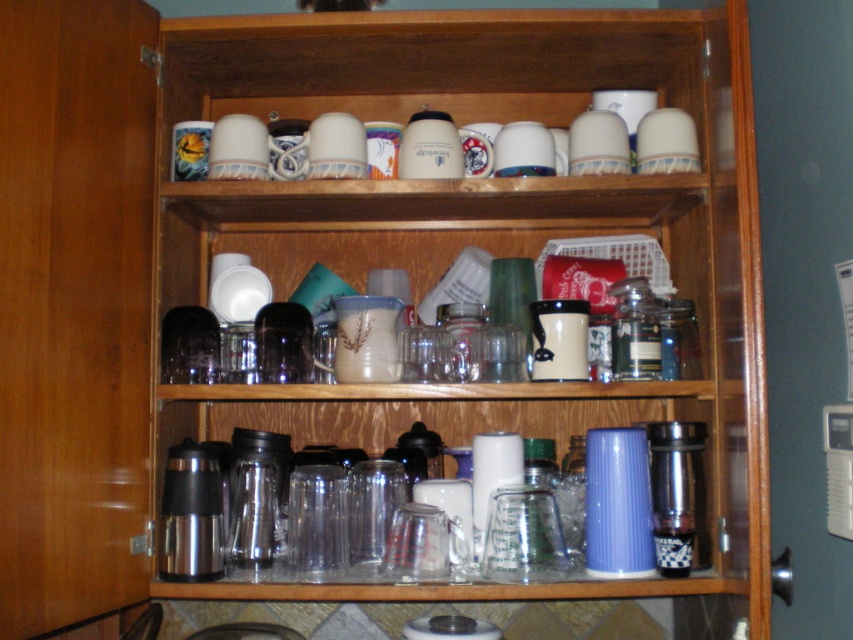
Does translucent glass cups at upper center have a greater height compared to metallic thermos at lower center?

Correct, translucent glass cups at upper center is much taller as metallic thermos at lower center.

Can you confirm if translucent glass cups at upper center is positioned above metallic thermos at lower center?

Yes.

Is point (698, 276) farther from camera compared to point (616, 388)?

Yes, point (698, 276) is behind point (616, 388).

This screenshot has height=640, width=853. What are the coordinates of `translucent glass cups at upper center` in the screenshot? It's located at (486, 248).